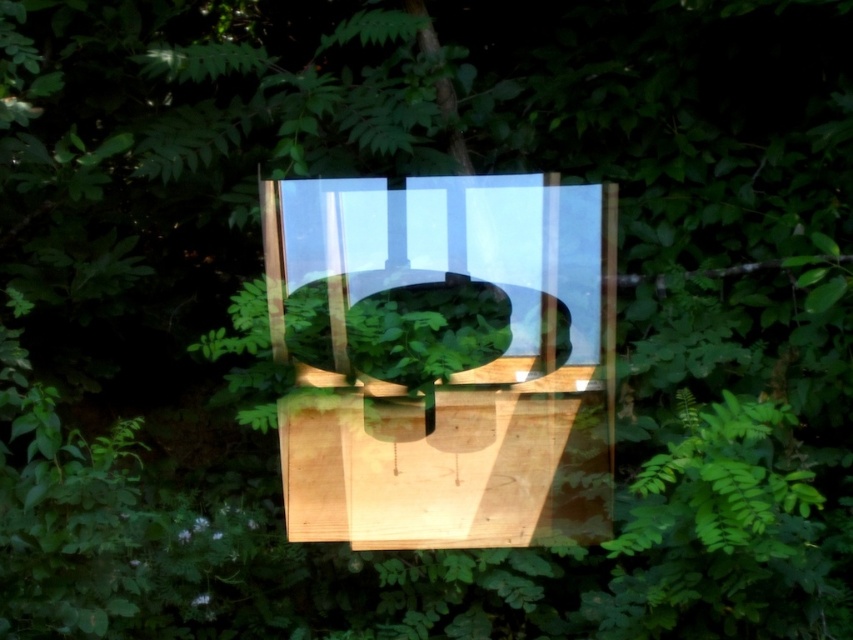
You are trying to place a decorative item on the transparent glass plate at center without blocking the view of the green matte bowl at center. Is this possible?

The green matte bowl at center is behind the transparent glass plate at center, so placing a decorative item on the transparent glass plate at center would block the view of the green matte bowl at center.

You are standing in front of the reflective surface and see two points marked in the reflection. Which point is closer to you, point (514, 346) or point (437, 282)?

Point (514, 346) is in front of point (437, 282), so it is closer to you.

You are a delivery person who needs to place a small package between the transparent glass plate at center and the green matte bowl at center. Can you fit the package if it measures 7 centimeters in length?

The distance between the transparent glass plate at center and the green matte bowl at center is 7.23 centimeters. Since the package is 7 centimeters long, it can fit within the space between them.